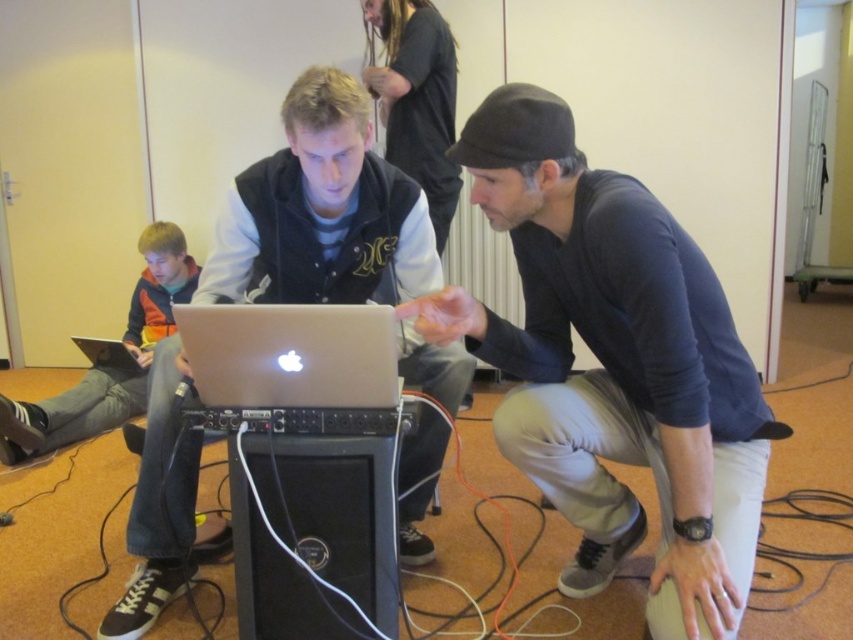
Question: Which point is closer to the camera?

Choices:
 (A) (316, 317)
 (B) (427, 340)
 (C) (85, 348)

Answer: (A)

Question: Among these points, which one is nearest to the camera?

Choices:
 (A) (97, 364)
 (B) (36, 406)
 (C) (254, 362)

Answer: (C)

Question: Is matte black laptop at center thinner than silver metallic laptop at lower left?

Choices:
 (A) no
 (B) yes

Answer: (A)

Question: Which of the following is the closest to the observer?

Choices:
 (A) dark gray knit cap at center
 (B) matte black laptop at center
 (C) silver metallic laptop at lower left

Answer: (A)

Question: Is matte black laptop at center below orange fleece jacket at left?

Choices:
 (A) no
 (B) yes

Answer: (B)

Question: Observing the image, what is the correct spatial positioning of matte black laptop at center in reference to silver metallic laptop at center?

Choices:
 (A) below
 (B) above

Answer: (A)